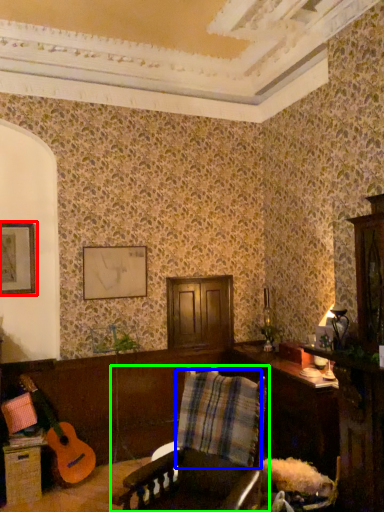
Question: Estimate the real-world distances between objects in this image. Which object is closer to picture frame (highlighted by a red box), plaid (highlighted by a blue box) or chair (highlighted by a green box)?

Choices:
 (A) plaid
 (B) chair

Answer: (A)